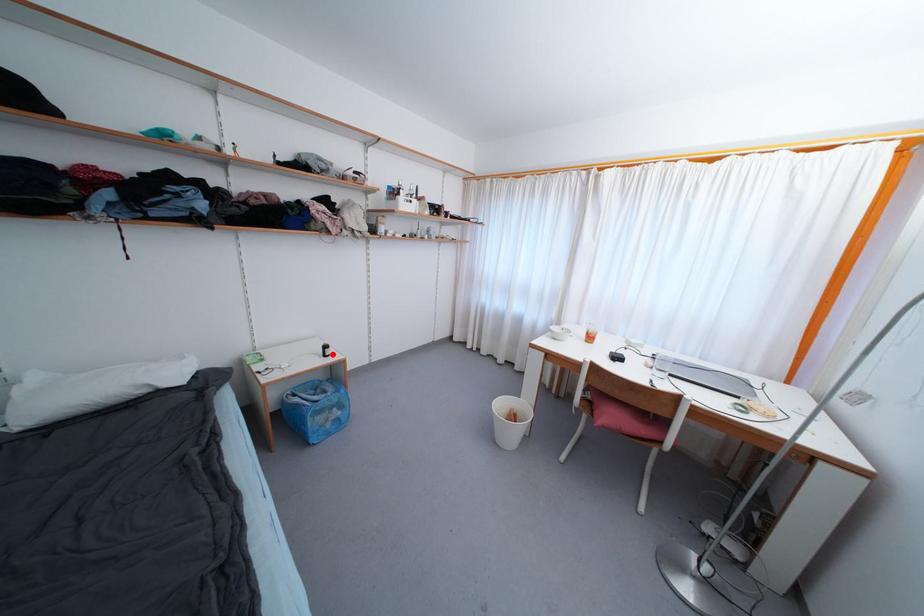
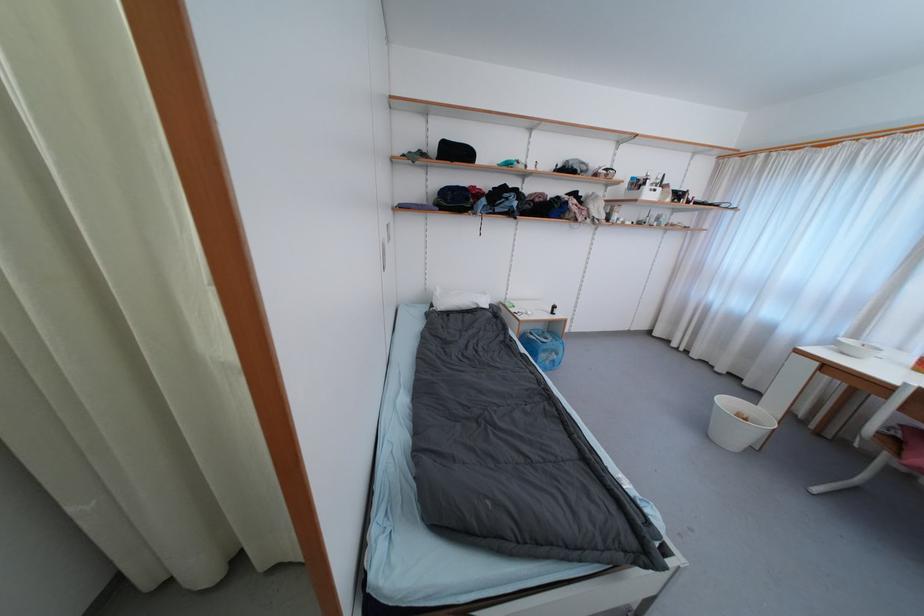
In the second image, find the point that corresponds to the highlighted location in the first image.

(560, 313)